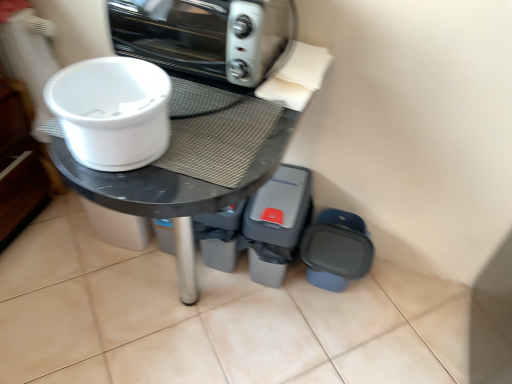
At what (x,y) coordinates should I click in order to perform the action: click on free area below matte plastic container at lower right, the second appliance viewed from the left (from a real-world perspective). Please return your answer as a coordinate pair (x, y). Looking at the image, I should click on (331, 294).